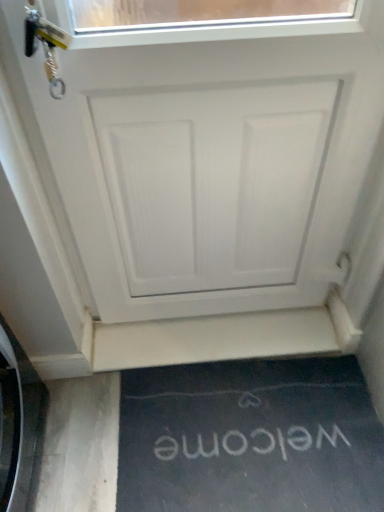
What is the approximate height of white matte stairwell at lower center?

0.94 inches.

The width and height of the screenshot is (384, 512). I want to click on white matte door at center, so click(x=206, y=181).

From the picture: Does black rubber doormat at lower center have a lesser width compared to white matte stairwell at lower center?

No, black rubber doormat at lower center is not thinner than white matte stairwell at lower center.

Are black rubber doormat at lower center and white matte stairwell at lower center far apart?

black rubber doormat at lower center is near white matte stairwell at lower center, not far away.

Could you tell me if black rubber doormat at lower center is turned towards white matte stairwell at lower center?

No.

Does point (231, 492) come farther from viewer compared to point (237, 242)?

That is False.

Considering the sizes of objects black rubber doormat at lower center and white matte door at center in the image provided, who is bigger, black rubber doormat at lower center or white matte door at center?

With larger size is white matte door at center.

Is black rubber doormat at lower center spatially inside white matte door at center, or outside of it?

The correct answer is: outside.

From a real-world perspective, does black rubber doormat at lower center stand above white matte door at center?

No, from a real-world perspective, black rubber doormat at lower center is not above white matte door at center.

I want to click on stairwell that is behind the white matte door at center, so click(226, 337).

How many degrees apart are the facing directions of white matte door at center and white matte stairwell at lower center?

0.697 degrees.

Which of these two, white matte door at center or white matte stairwell at lower center, stands taller?

white matte door at center.

Is white matte door at center aimed at white matte stairwell at lower center?

No.

Which is behind, point (307, 347) or point (126, 439)?

Point (307, 347)

Who is shorter, white matte stairwell at lower center or black rubber doormat at lower center?

With less height is white matte stairwell at lower center.

Is black rubber doormat at lower center completely or partially inside white matte stairwell at lower center?

No.

From the image's perspective, which one is positioned lower, white matte stairwell at lower center or black rubber doormat at lower center?

black rubber doormat at lower center.

Between white matte stairwell at lower center and white matte door at center, which one has less height?

white matte stairwell at lower center.

Considering the sizes of objects white matte stairwell at lower center and white matte door at center in the image provided, who is bigger, white matte stairwell at lower center or white matte door at center?

Bigger between the two is white matte door at center.

Is white matte stairwell at lower center oriented towards white matte door at center?

No, white matte stairwell at lower center is not turned towards white matte door at center.

From a real-world perspective, is white matte stairwell at lower center physically above white matte door at center?

Incorrect, from a real-world perspective, white matte stairwell at lower center is lower than white matte door at center.

Image resolution: width=384 pixels, height=512 pixels. In order to click on doormat that appears below the white matte door at center (from the image's perspective) in this screenshot , I will do `click(250, 438)`.

From a real-world perspective, relative to black rubber doormat at lower center, is white matte door at center vertically above or below?

white matte door at center is situated higher than black rubber doormat at lower center in the real world.

Is white matte door at center oriented away from black rubber doormat at lower center?

No, white matte door at center is not facing the opposite direction of black rubber doormat at lower center.

Who is bigger, white matte door at center or black rubber doormat at lower center?

With larger size is white matte door at center.

At what (x,y) coordinates should I click in order to perform the action: click on stairwell behind the black rubber doormat at lower center. Please return your answer as a coordinate pair (x, y). This screenshot has width=384, height=512. Looking at the image, I should click on (226, 337).

What are the coordinates of `doormat beneath the white matte door at center (from a real-world perspective)` in the screenshot? It's located at (250, 438).

Considering their positions, is white matte stairwell at lower center positioned closer to white matte door at center than black rubber doormat at lower center?

Based on the image, white matte stairwell at lower center appears to be nearer to white matte door at center.

Estimate the real-world distances between objects in this image. Which object is closer to white matte stairwell at lower center, white matte door at center or black rubber doormat at lower center?

black rubber doormat at lower center is closer to white matte stairwell at lower center.

Which object lies nearer to the anchor point white matte stairwell at lower center, black rubber doormat at lower center or white matte door at center?

black rubber doormat at lower center is positioned closer to the anchor white matte stairwell at lower center.

Which object lies further to the anchor point black rubber doormat at lower center, white matte door at center or white matte stairwell at lower center?

white matte door at center lies further to black rubber doormat at lower center than the other object.

Based on their spatial positions, is black rubber doormat at lower center or white matte stairwell at lower center closer to white matte door at center?

Based on the image, white matte stairwell at lower center appears to be nearer to white matte door at center.

Looking at the image, which one is located closer to black rubber doormat at lower center, white matte stairwell at lower center or white matte door at center?

white matte stairwell at lower center.

This screenshot has height=512, width=384. Find the location of `doormat located between white matte door at center and white matte stairwell at lower center in the depth direction`. doormat located between white matte door at center and white matte stairwell at lower center in the depth direction is located at coordinates (250, 438).